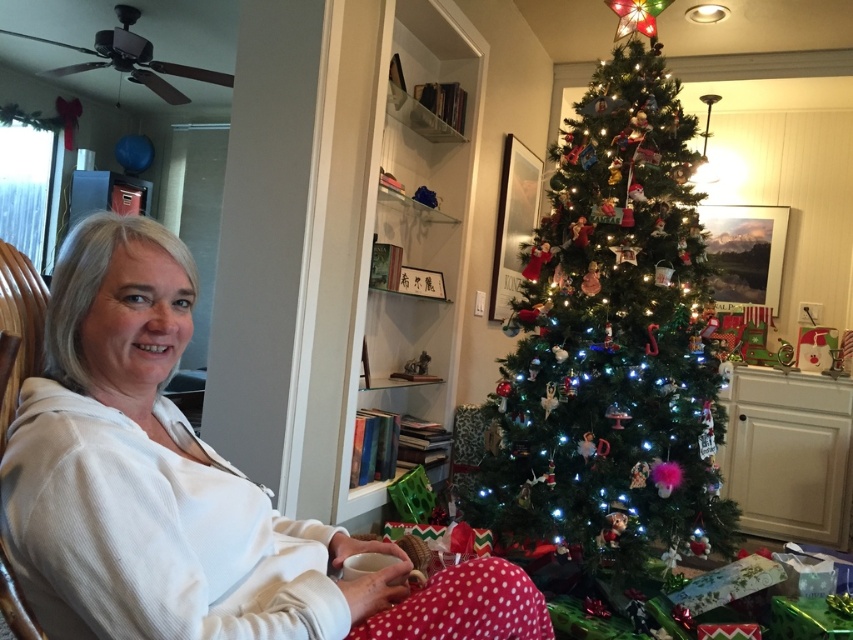
Question: Does white soft sweater at center have a larger size compared to green matte christmas tree at center?

Choices:
 (A) no
 (B) yes

Answer: (A)

Question: Observing the image, what is the correct spatial positioning of white soft sweater at center in reference to green matte christmas tree at center?

Choices:
 (A) right
 (B) left

Answer: (B)

Question: Which point is closer to the camera?

Choices:
 (A) green matte christmas tree at center
 (B) white soft sweater at center

Answer: (B)

Question: Which point is closer to the camera taking this photo?

Choices:
 (A) (57, 568)
 (B) (683, 513)

Answer: (A)

Question: Does white soft sweater at center appear on the right side of green matte christmas tree at center?

Choices:
 (A) no
 (B) yes

Answer: (A)